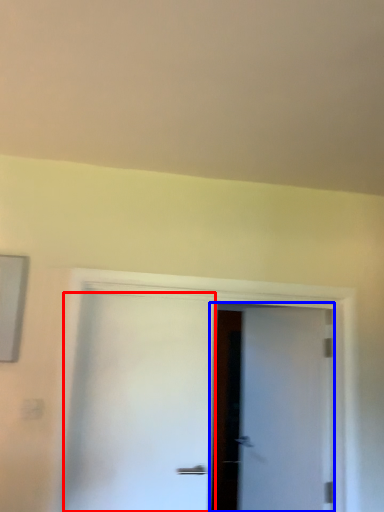
Question: Among these objects, which one is nearest to the camera, door (highlighted by a red box) or door (highlighted by a blue box)?

Choices:
 (A) door
 (B) door

Answer: (A)